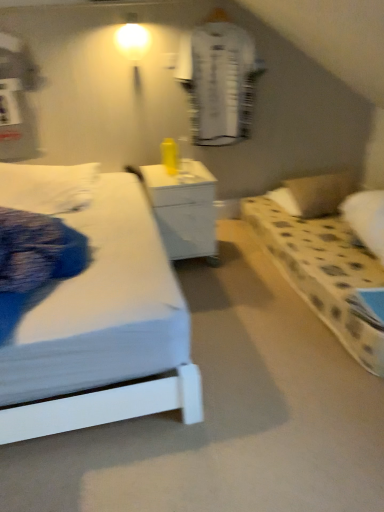
Question: Would you say white glossy nightstand at center is a long distance from white dotted pillow at right?

Choices:
 (A) yes
 (B) no

Answer: (B)

Question: From a real-world perspective, is white glossy nightstand at center under white dotted pillow at right?

Choices:
 (A) no
 (B) yes

Answer: (A)

Question: Can you confirm if white glossy nightstand at center is thinner than white dotted pillow at right?

Choices:
 (A) yes
 (B) no

Answer: (B)

Question: Does white glossy nightstand at center have a smaller size compared to white dotted pillow at right?

Choices:
 (A) no
 (B) yes

Answer: (A)

Question: Can you confirm if white glossy nightstand at center is positioned to the right of white dotted pillow at right?

Choices:
 (A) no
 (B) yes

Answer: (A)

Question: Do you think white textured robe at upper center is within matte white bulb at upper center, or outside of it?

Choices:
 (A) inside
 (B) outside

Answer: (B)

Question: Considering the positions of white textured robe at upper center and matte white bulb at upper center in the image, is white textured robe at upper center wider or thinner than matte white bulb at upper center?

Choices:
 (A) thin
 (B) wide

Answer: (A)

Question: Is white textured robe at upper center bigger or smaller than matte white bulb at upper center?

Choices:
 (A) small
 (B) big

Answer: (B)

Question: In terms of height, does white textured robe at upper center look taller or shorter compared to matte white bulb at upper center?

Choices:
 (A) short
 (B) tall

Answer: (B)

Question: Does point (170, 243) appear closer or farther from the camera than point (205, 121)?

Choices:
 (A) closer
 (B) farther

Answer: (A)

Question: From a real-world perspective, is white glossy nightstand at center physically located above or below white textured robe at upper center?

Choices:
 (A) below
 (B) above

Answer: (A)

Question: Considering the positions of white glossy nightstand at center and white textured robe at upper center in the image, is white glossy nightstand at center taller or shorter than white textured robe at upper center?

Choices:
 (A) tall
 (B) short

Answer: (B)

Question: Looking at their shapes, would you say white glossy nightstand at center is wider or thinner than white textured robe at upper center?

Choices:
 (A) wide
 (B) thin

Answer: (A)

Question: Does point (241, 138) appear closer or farther from the camera than point (195, 252)?

Choices:
 (A) farther
 (B) closer

Answer: (A)

Question: From a real-world perspective, is white textured robe at upper center physically located above or below white glossy nightstand at center?

Choices:
 (A) above
 (B) below

Answer: (A)